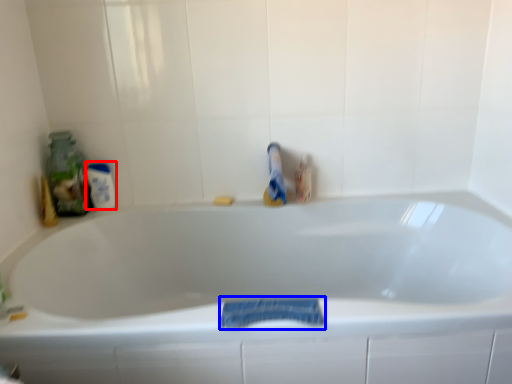
Question: Which object is further to the camera taking this photo, mouthwash (highlighted by a red box) or bath towel (highlighted by a blue box)?

Choices:
 (A) mouthwash
 (B) bath towel

Answer: (A)